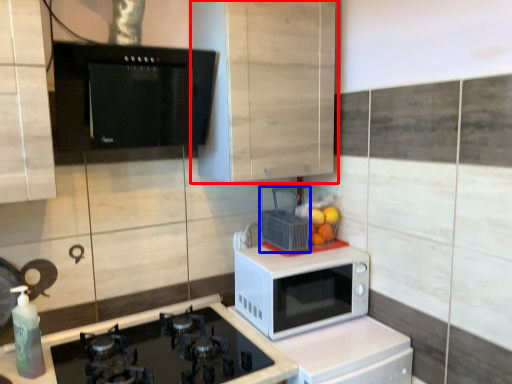
Question: Which object appears closest to the camera in this image, cabinetry (highlighted by a red box) or basket (highlighted by a blue box)?

Choices:
 (A) cabinetry
 (B) basket

Answer: (A)